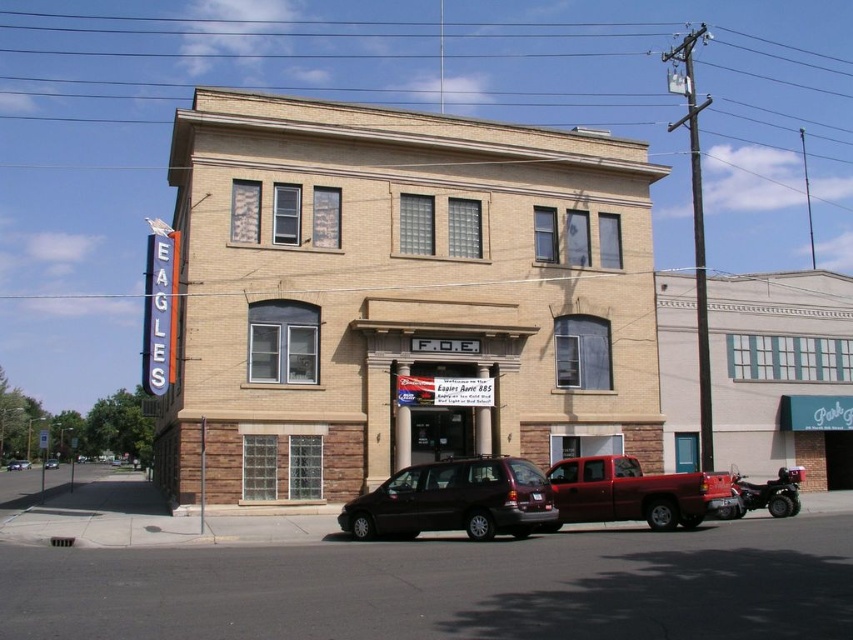
You are a delivery driver who needs to park your vehicle between the matte black minivan at center and the metallic red truck at center. Is there enough space for your vehicle, which is 2 meters wide?

The matte black minivan at center is positioned on the left side of metallic red truck at center. The distance between them is not specified, so it is impossible to determine if there is enough space for your 2 meter wide vehicle.

You are a delivery person trying to park your vehicle in the parking lot in front of the two story brick building. There are two vans parked at the center. Which van, the matte black minivan at center or the shiny black van at center, is positioned higher up and would block your view of the lower one?

The matte black minivan at center is located above the shiny black van at center, so it would block your view of the shiny black van at center.